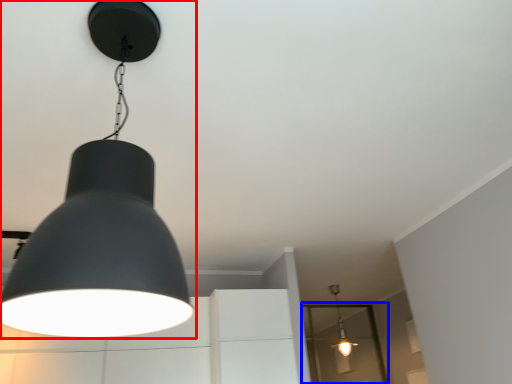
Question: Which object appears farthest to the camera in this image, lamp (highlighted by a red box) or glass door (highlighted by a blue box)?

Choices:
 (A) lamp
 (B) glass door

Answer: (B)